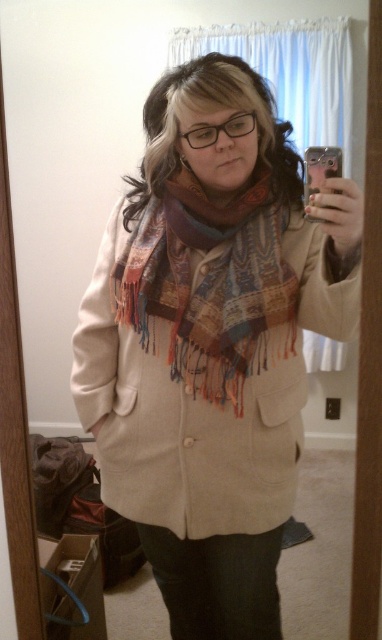
Which is more to the right, paisley scarf at center or multicolored woven scarf at center?

Positioned to the right is multicolored woven scarf at center.

Does paisley scarf at center have a lesser height compared to multicolored woven scarf at center?

Incorrect, paisley scarf at center's height does not fall short of multicolored woven scarf at center's.

This screenshot has height=640, width=382. In order to click on paisley scarf at center in this screenshot , I will do `click(212, 342)`.

The height and width of the screenshot is (640, 382). In order to click on paisley scarf at center in this screenshot , I will do `click(212, 342)`.

Is multicolored woven scarf at center smaller than metallic silver phone at upper right?

Actually, multicolored woven scarf at center might be larger than metallic silver phone at upper right.

Between point (286, 353) and point (330, 172), which one is positioned in front?

Positioned in front is point (330, 172).

Does point (212, 316) come closer to viewer compared to point (317, 150)?

That is False.

At what (x,y) coordinates should I click in order to perform the action: click on multicolored woven scarf at center. Please return your answer as a coordinate pair (x, y). This screenshot has width=382, height=640. Looking at the image, I should click on (210, 284).

Is paisley scarf at center bigger than metallic silver phone at upper right?

Yes, paisley scarf at center is bigger than metallic silver phone at upper right.

Is point (221, 253) positioned before point (339, 170)?

No, (221, 253) is behind (339, 170).

The width and height of the screenshot is (382, 640). What do you see at coordinates (212, 342) in the screenshot?
I see `paisley scarf at center` at bounding box center [212, 342].

In order to click on paisley scarf at center in this screenshot , I will do `click(212, 342)`.